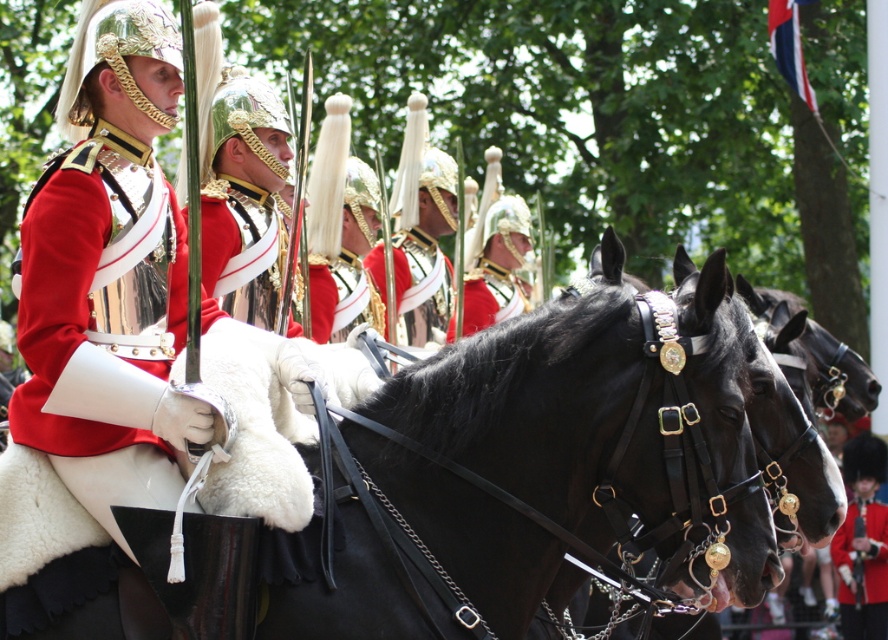
Question: Does black leather horse at center have a larger size compared to metallic silver helmet at center?

Choices:
 (A) no
 (B) yes

Answer: (B)

Question: Which point is closer to the camera taking this photo?

Choices:
 (A) (488, 282)
 (B) (553, 348)
 (C) (448, 291)

Answer: (B)

Question: Which point is farther to the camera?

Choices:
 (A) shiny gold helmet at center
 (B) metallic silver helmet at center
 (C) shiny red fabric at center

Answer: (A)

Question: Is black leather horse at center to the left of shiny gold helmet at center from the viewer's perspective?

Choices:
 (A) yes
 (B) no

Answer: (A)

Question: Does black leather horse at center appear on the left side of metallic silver helmet at center?

Choices:
 (A) no
 (B) yes

Answer: (A)

Question: Which object is closer to the camera taking this photo?

Choices:
 (A) metallic silver helmet at center
 (B) shiny red fabric at center

Answer: (B)